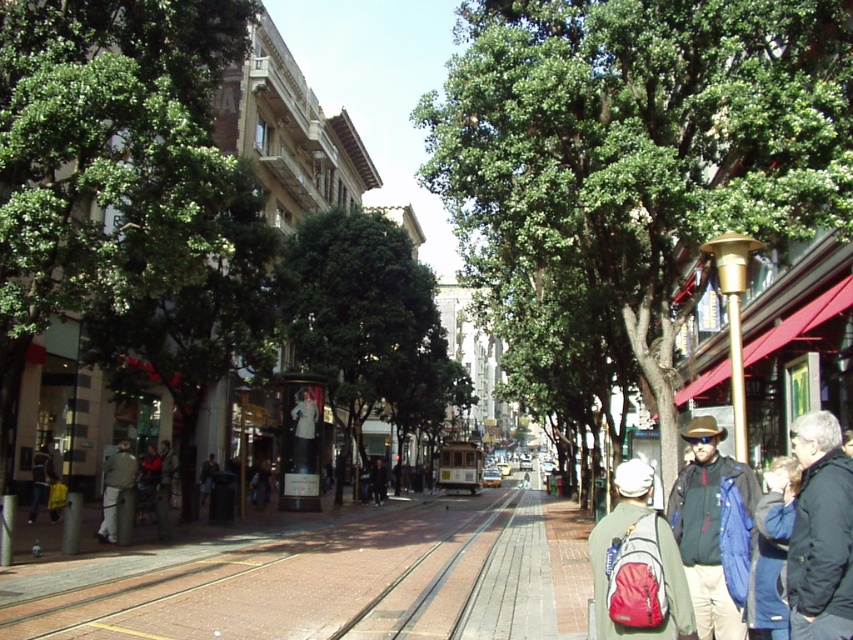
You are standing on the street and want to walk towards the two points marked in the image. Which point, point [631,628] or point [448,611], will you reach first?

Point [631,628] is closer to the viewer than point [448,611], so you will reach point [631,628] first.

You are a delivery person needing to cross the street to deliver a package. There is a matte green jacket at center and a brick train track at center. Which object is closer to the ground?

The brick train track at center is closer to the ground because the matte green jacket at center is located above it.

Consider the image. You are a pedestrian standing on the sidewalk. You see a matte green jacket at center and a brick train track at center. Which object is closer to you?

The matte green jacket at center is closer to you because it is in front of the brick train track at center.